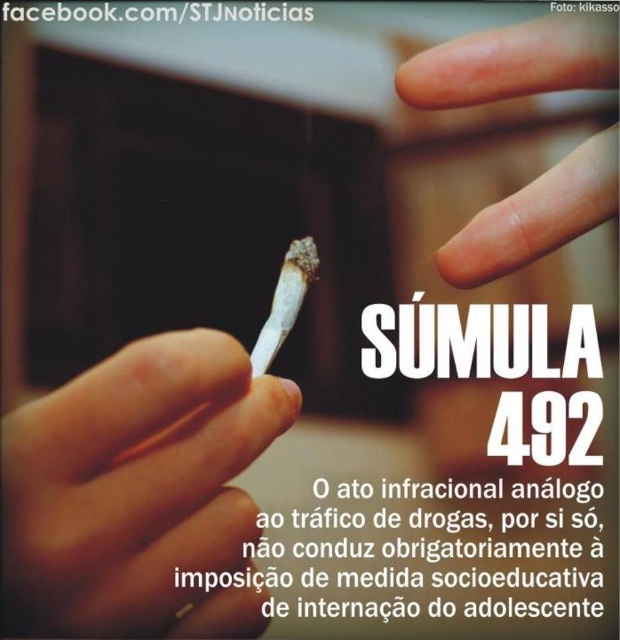
The height and width of the screenshot is (640, 620). What are the coordinates of `white matte cigarette at center` in the screenshot? It's located at (138, 490).

Between point (170, 371) and point (595, 26), which one is positioned in front?

Point (170, 371) is in front.

This screenshot has height=640, width=620. Identify the location of white matte cigarette at center. (138, 490).